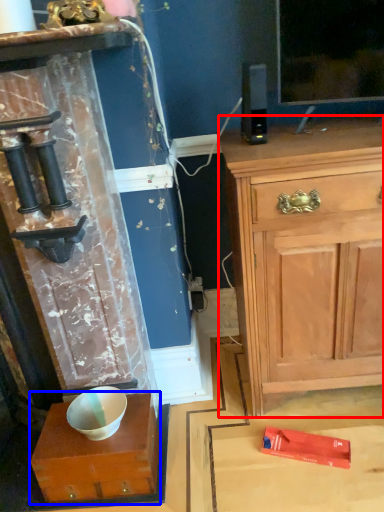
Question: Which of the following is the closest to the observer, chest of drawers (highlighted by a red box) or cabinetry (highlighted by a blue box)?

Choices:
 (A) chest of drawers
 (B) cabinetry

Answer: (A)